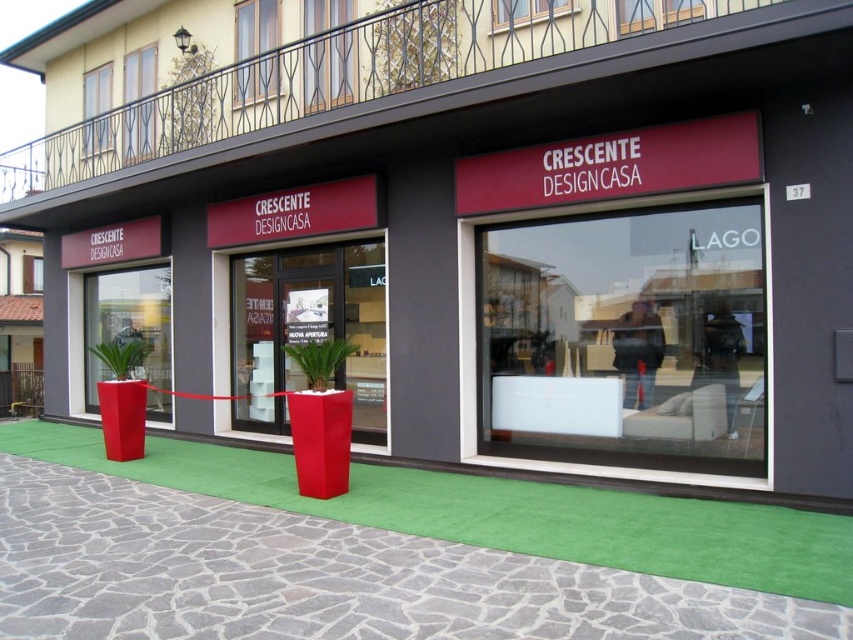
Question: Which object appears closest to the camera in this image?

Choices:
 (A) matte red planter at center
 (B) transparent glass window at center

Answer: (B)

Question: Does green stone pavement at lower center appear on the left side of matte red planter at center?

Choices:
 (A) no
 (B) yes

Answer: (A)

Question: Does green stone pavement at lower center appear on the right side of matte red planter at center?

Choices:
 (A) no
 (B) yes

Answer: (B)

Question: Does green stone pavement at lower center lie in front of matte red planter at center?

Choices:
 (A) yes
 (B) no

Answer: (A)

Question: Which point is farther to the camera?

Choices:
 (A) transparent glass window at center
 (B) matte red planter at center

Answer: (B)

Question: Estimate the real-world distances between objects in this image. Which object is closer to the transparent glass window at center?

Choices:
 (A) matte red planter at center
 (B) matte red planter at center left

Answer: (A)